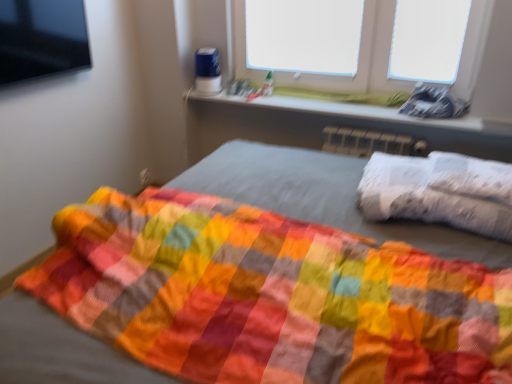
This screenshot has height=384, width=512. What do you see at coordinates (361, 57) in the screenshot?
I see `transparent plastic window at upper center` at bounding box center [361, 57].

What is the approximate height of white textured pillow at right?

7.62 inches.

Where is `transparent plastic window at upper center`? The height and width of the screenshot is (384, 512). transparent plastic window at upper center is located at coordinates (361, 57).

From the image's perspective, is transparent plastic at upper right, arranged as the 2th window screen when viewed from the left, under transparent plastic window at upper center?

Indeed, from the image's perspective, transparent plastic at upper right, arranged as the 2th window screen when viewed from the left, is shown beneath transparent plastic window at upper center.

Does transparent plastic at upper right, arranged as the 2th window screen when viewed from the left, have a lesser width compared to transparent plastic window at upper center?

Yes.

From a real-world perspective, which window screen is the 2nd one above the transparent plastic window at upper center? Please provide its 2D coordinates.

[(428, 40)]

Considering the relative positions of transparent plastic at upper right, arranged as the 2th window screen when viewed from the left, and transparent plastic window at upper center in the image provided, is transparent plastic at upper right, arranged as the 2th window screen when viewed from the left, to the left of transparent plastic window at upper center from the viewer's perspective?

No, transparent plastic at upper right, arranged as the 2th window screen when viewed from the left, is not to the left of transparent plastic window at upper center.

Is white plastic window sill at upper center not inside transparent plastic at upper right, arranged as the 2th window screen when viewed from the left?

white plastic window sill at upper center lies outside transparent plastic at upper right, arranged as the 2th window screen when viewed from the left,'s area.

Does white plastic window sill at upper center have a lesser height compared to transparent plastic at upper right, arranged as the 2th window screen when viewed from the left?

Correct, white plastic window sill at upper center is not as tall as transparent plastic at upper right, arranged as the 2th window screen when viewed from the left.

Is white plastic window sill at upper center with transparent plastic at upper right, arranged as the 2th window screen when viewed from the left?

No, white plastic window sill at upper center is not making contact with transparent plastic at upper right, arranged as the 2th window screen when viewed from the left.

Is transparent plastic at upper right, the 1th window screen positioned from the right, at the back of white plastic window sill at upper center?

No, transparent plastic at upper right, the 1th window screen positioned from the right, is not at the back of white plastic window sill at upper center.

Between transparent plastic at upper right, arranged as the 2th window screen when viewed from the left, and white matte window screen at upper center, the first window screen when ordered from left to right, which one appears on the left side from the viewer's perspective?

From the viewer's perspective, white matte window screen at upper center, the first window screen when ordered from left to right, appears more on the left side.

What's the angular difference between transparent plastic at upper right, arranged as the 2th window screen when viewed from the left, and white matte window screen at upper center, the second window screen viewed from the right,'s facing directions?

The angular difference between transparent plastic at upper right, arranged as the 2th window screen when viewed from the left, and white matte window screen at upper center, the second window screen viewed from the right, is 0.000112 degrees.

Considering the relative sizes of transparent plastic at upper right, the 1th window screen positioned from the right, and white matte window screen at upper center, the second window screen viewed from the right, in the image provided, is transparent plastic at upper right, the 1th window screen positioned from the right, bigger than white matte window screen at upper center, the second window screen viewed from the right,?

Incorrect, transparent plastic at upper right, the 1th window screen positioned from the right, is not larger than white matte window screen at upper center, the second window screen viewed from the right.

Is transparent plastic at upper right, the 1th window screen positioned from the right, spatially inside white matte window screen at upper center, the first window screen when ordered from left to right, or outside of it?

transparent plastic at upper right, the 1th window screen positioned from the right, lies outside white matte window screen at upper center, the first window screen when ordered from left to right.

Is white matte window screen at upper center, the first window screen when ordered from left to right, taller than white textured pillow at right?

Indeed, white matte window screen at upper center, the first window screen when ordered from left to right, has a greater height compared to white textured pillow at right.

Considering the relative sizes of white matte window screen at upper center, the second window screen viewed from the right, and white textured pillow at right in the image provided, is white matte window screen at upper center, the second window screen viewed from the right, wider than white textured pillow at right?

Incorrect, the width of white matte window screen at upper center, the second window screen viewed from the right, does not surpass that of white textured pillow at right.

Identify the location of throw pillow that is on the right side of white matte window screen at upper center, the first window screen when ordered from left to right. (440, 191).

Is there a large distance between white matte window screen at upper center, the second window screen viewed from the right, and white textured pillow at right?

white matte window screen at upper center, the second window screen viewed from the right, is far away from white textured pillow at right.

Does point (276, 56) lie behind point (463, 34)?

Yes, it is behind point (463, 34).

Is white matte window screen at upper center, the first window screen when ordered from left to right, wider than transparent plastic at upper right, arranged as the 2th window screen when viewed from the left?

Indeed, white matte window screen at upper center, the first window screen when ordered from left to right, has a greater width compared to transparent plastic at upper right, arranged as the 2th window screen when viewed from the left.

Is transparent plastic at upper right, arranged as the 2th window screen when viewed from the left, surrounded by white matte window screen at upper center, the first window screen when ordered from left to right?

No, white matte window screen at upper center, the first window screen when ordered from left to right, does not contain transparent plastic at upper right, arranged as the 2th window screen when viewed from the left.

Is white matte window screen at upper center, the second window screen viewed from the right, to the right of transparent plastic at upper right, the 1th window screen positioned from the right, from the viewer's perspective?

Incorrect, white matte window screen at upper center, the second window screen viewed from the right, is not on the right side of transparent plastic at upper right, the 1th window screen positioned from the right.

Does white textured pillow at right turn towards transparent plastic at upper right, arranged as the 2th window screen when viewed from the left?

No, white textured pillow at right is not turned towards transparent plastic at upper right, arranged as the 2th window screen when viewed from the left.

Can you confirm if white textured pillow at right is shorter than transparent plastic at upper right, the 1th window screen positioned from the right?

Indeed, white textured pillow at right has a lesser height compared to transparent plastic at upper right, the 1th window screen positioned from the right.

From a real-world perspective, who is located lower, white textured pillow at right or transparent plastic at upper right, arranged as the 2th window screen when viewed from the left?

white textured pillow at right is physically lower.

Does white textured pillow at right touch transparent plastic at upper right, arranged as the 2th window screen when viewed from the left?

white textured pillow at right and transparent plastic at upper right, arranged as the 2th window screen when viewed from the left, are clearly separated.

From a real-world perspective, is white textured pillow at right positioned above or below white plastic window sill at upper center?

From a real-world perspective, white textured pillow at right is physically below white plastic window sill at upper center.

Considering the sizes of objects white textured pillow at right and white plastic window sill at upper center in the image provided, who is wider, white textured pillow at right or white plastic window sill at upper center?

white textured pillow at right is wider.

From the image's perspective, is white textured pillow at right on white plastic window sill at upper center?

No, from the image's perspective, white textured pillow at right is not on top of white plastic window sill at upper center.

Is white textured pillow at right oriented towards white plastic window sill at upper center?

No, white textured pillow at right is not turned towards white plastic window sill at upper center.

This screenshot has height=384, width=512. There is a transparent plastic window at upper center. Find the location of `the 2nd window screen above it (from a real-world perspective)`. the 2nd window screen above it (from a real-world perspective) is located at coordinates (428, 40).

The image size is (512, 384). Find the location of `window sill in front of the transparent plastic at upper right, arranged as the 2th window screen when viewed from the left`. window sill in front of the transparent plastic at upper right, arranged as the 2th window screen when viewed from the left is located at coordinates (340, 107).

Based on their spatial positions, is transparent plastic at upper right, arranged as the 2th window screen when viewed from the left, or white textured pillow at right further from white plastic window sill at upper center?

Based on the image, white textured pillow at right appears to be further to white plastic window sill at upper center.

Considering their positions, is white textured pillow at right positioned closer to transparent plastic at upper right, arranged as the 2th window screen when viewed from the left, than white matte window screen at upper center, the second window screen viewed from the right?

white matte window screen at upper center, the second window screen viewed from the right, is positioned closer to the anchor transparent plastic at upper right, arranged as the 2th window screen when viewed from the left.

Which object lies nearer to the anchor point white matte window screen at upper center, the second window screen viewed from the right, transparent plastic window at upper center or white plastic window sill at upper center?

The object closer to white matte window screen at upper center, the second window screen viewed from the right, is transparent plastic window at upper center.

Which object lies nearer to the anchor point white plastic window sill at upper center, transparent plastic window at upper center or white textured pillow at right?

Among the two, transparent plastic window at upper center is located nearer to white plastic window sill at upper center.

Looking at the image, which one is located closer to white plastic window sill at upper center, white matte window screen at upper center, the second window screen viewed from the right, or transparent plastic window at upper center?

Among the two, transparent plastic window at upper center is located nearer to white plastic window sill at upper center.

Considering their positions, is white matte window screen at upper center, the second window screen viewed from the right, positioned further to white textured pillow at right than white plastic window sill at upper center?

white matte window screen at upper center, the second window screen viewed from the right, is further to white textured pillow at right.

When comparing their distances from white textured pillow at right, does white matte window screen at upper center, the first window screen when ordered from left to right, or transparent plastic at upper right, the 1th window screen positioned from the right, seem closer?

Among the two, transparent plastic at upper right, the 1th window screen positioned from the right, is located nearer to white textured pillow at right.

Considering their positions, is white textured pillow at right positioned closer to white matte window screen at upper center, the second window screen viewed from the right, than transparent plastic window at upper center?

transparent plastic window at upper center lies closer to white matte window screen at upper center, the second window screen viewed from the right, than the other object.

The height and width of the screenshot is (384, 512). I want to click on window sill between white textured pillow at right and white matte window screen at upper center, the second window screen viewed from the right, in the front-back direction, so click(340, 107).

This screenshot has height=384, width=512. Identify the location of window between white textured pillow at right and white matte window screen at upper center, the second window screen viewed from the right, in the front-back direction. (361, 57).

You are a GUI agent. You are given a task and a screenshot of the screen. Output one action in this format:
    pyautogui.click(x=<x>, y=<y>)
    Task: Click on the window between white matte window screen at upper center, the second window screen viewed from the right, and white plastic window sill at upper center in the up-down direction
    The image size is (512, 384).
    Given the screenshot: What is the action you would take?
    pyautogui.click(x=361, y=57)

Identify the location of window situated between white plastic window sill at upper center and transparent plastic at upper right, arranged as the 2th window screen when viewed from the left, from left to right. Image resolution: width=512 pixels, height=384 pixels. (361, 57).